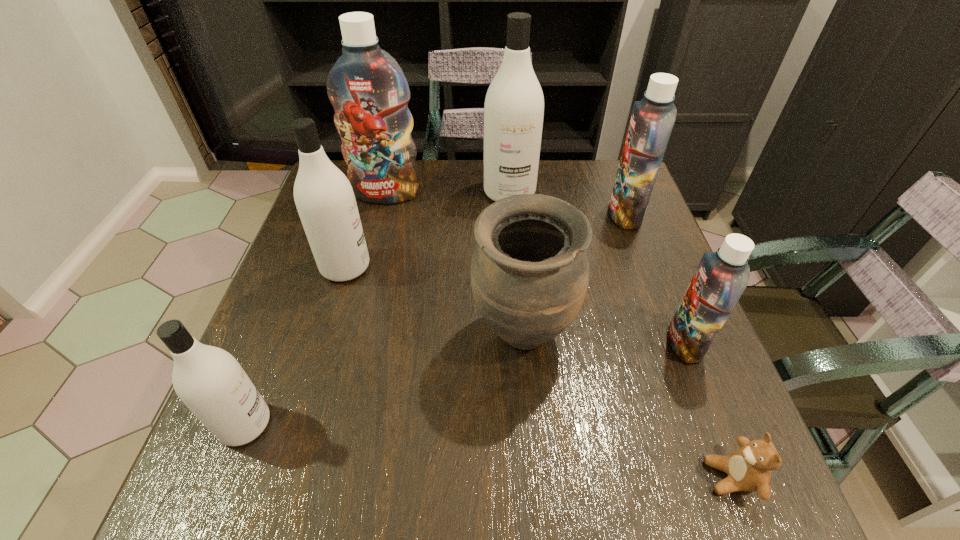
Find the location of a particular element. the nearest shampoo is located at coordinates (209, 380).

In order to click on the shortest object in this screenshot , I will do `click(749, 468)`.

Identify the location of free location located 0.230m on the front-facing side of the rightmost white shampoo. The height and width of the screenshot is (540, 960). (516, 268).

The width and height of the screenshot is (960, 540). What are the coordinates of `vacant space located 0.190m on the front label of the biggest blue shampoo` in the screenshot? It's located at (372, 253).

Image resolution: width=960 pixels, height=540 pixels. I want to click on vacant region located on the front label of the second biggest blue shampoo, so click(x=589, y=214).

Where is `free location located on the front label of the second biggest blue shampoo`? This screenshot has height=540, width=960. free location located on the front label of the second biggest blue shampoo is located at coordinates (x=515, y=214).

You are a GUI agent. You are given a task and a screenshot of the screen. Output one action in this format:
    pyautogui.click(x=<x>, y=<y>)
    Task: Click on the free point located on the front label of the second biggest blue shampoo
    
    Given the screenshot: What is the action you would take?
    coord(511,214)

Identify the location of free space located on the front-facing side of the fourth farthest object. (435, 267).

The width and height of the screenshot is (960, 540). Find the location of `free region located 0.070m on the left of the urn`. free region located 0.070m on the left of the urn is located at coordinates (438, 335).

This screenshot has height=540, width=960. Identify the location of free space located on the front label of the nearest blue shampoo. (599, 343).